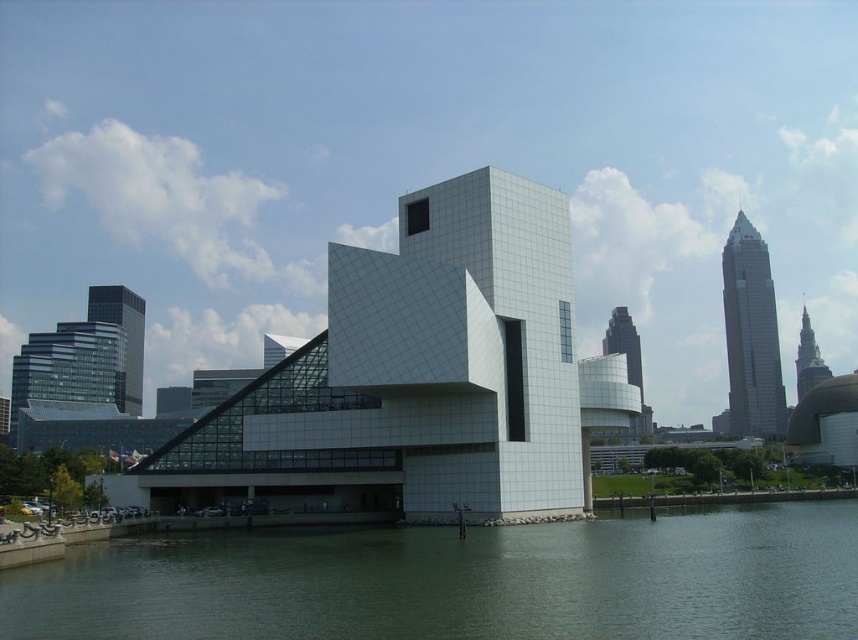
Question: Which point is farther from the camera taking this photo?

Choices:
 (A) (727, 280)
 (B) (458, 538)

Answer: (A)

Question: Does green smooth water at lower center come in front of glass skyscraper at upper right?

Choices:
 (A) no
 (B) yes

Answer: (B)

Question: Does green smooth water at lower center come in front of glass skyscraper at upper right?

Choices:
 (A) yes
 (B) no

Answer: (A)

Question: Which of the following is the closest to the observer?

Choices:
 (A) glass skyscraper at upper right
 (B) green smooth water at lower center

Answer: (B)

Question: Where is green smooth water at lower center located in relation to glass skyscraper at upper right in the image?

Choices:
 (A) right
 (B) left

Answer: (B)